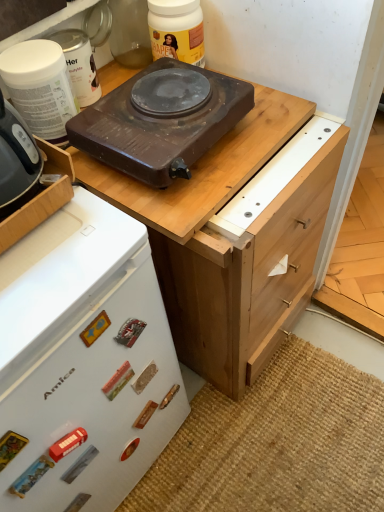
Question: From their relative heights in the image, would you say light brown wood drawer at right is taller or shorter than white plastic container at upper left, arranged as the third kitchen appliance when viewed from the right?

Choices:
 (A) tall
 (B) short

Answer: (B)

Question: Is point (279, 221) positioned closer to the camera than point (69, 60)?

Choices:
 (A) farther
 (B) closer

Answer: (B)

Question: Which object is the farthest from the matte black hot plate at upper center, positioned as the fourth kitchen appliance in left-to-right order?

Choices:
 (A) white plastic container at upper left, which ranks as the first kitchen appliance in left-to-right order
 (B) light brown wood drawer at right
 (C) brown matte electric stove at upper center
 (D) brown wooden chest of drawers at upper center
 (E) brown matte electric stove at upper center, positioned as the second kitchen appliance in right-to-left order

Answer: (C)

Question: Which object is the closest to the brown matte electric stove at upper center?

Choices:
 (A) matte black hot plate at upper center, the first kitchen appliance in the right-to-left sequence
 (B) white plastic container at upper left, the 4th kitchen appliance from the right
 (C) white plastic container at upper left, arranged as the third kitchen appliance when viewed from the right
 (D) light brown wood drawer at right
 (E) brown matte electric stove at upper center, the 3th kitchen appliance viewed from the left

Answer: (E)